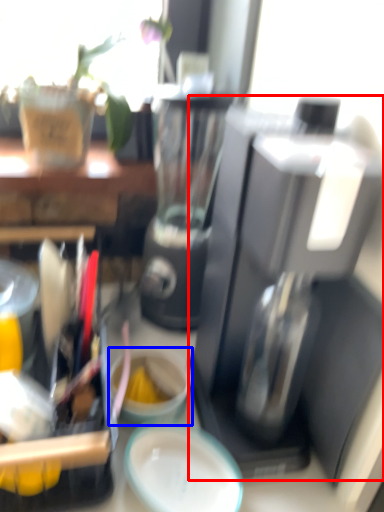
Question: Which of the following is the closest to the observer, coffee maker (highlighted by a red box) or coffee cup (highlighted by a blue box)?

Choices:
 (A) coffee maker
 (B) coffee cup

Answer: (A)